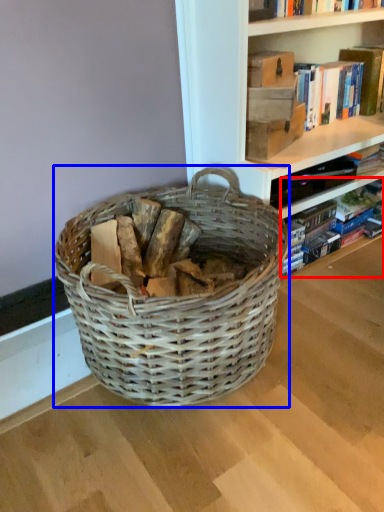
Question: Which object appears farthest to the camera in this image, book (highlighted by a red box) or picnic basket (highlighted by a blue box)?

Choices:
 (A) book
 (B) picnic basket

Answer: (A)